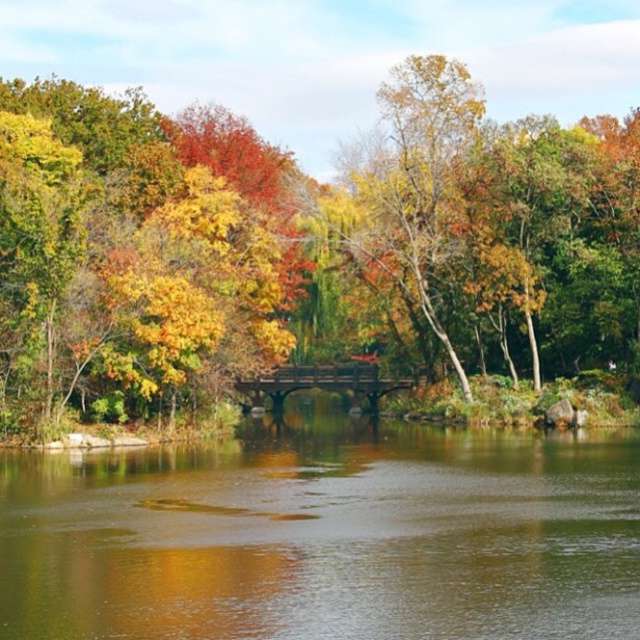
Is point (397, 186) less distant than point (525, 456)?

No, (397, 186) is further to viewer.

The width and height of the screenshot is (640, 640). What do you see at coordinates (301, 248) in the screenshot?
I see `yellow matte tree at center` at bounding box center [301, 248].

This screenshot has width=640, height=640. Find the location of `yellow matte tree at center`. yellow matte tree at center is located at coordinates (301, 248).